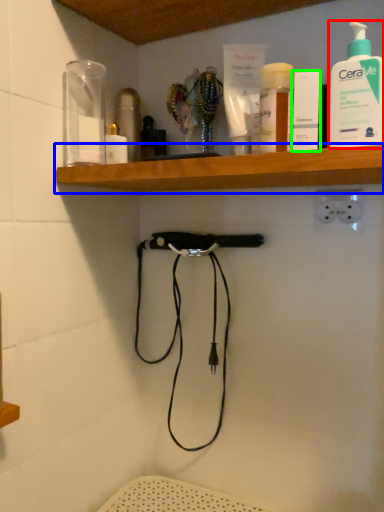
Question: Which object is the farthest from cleaning product (highlighted by a red box)? Choose among these: shelf (highlighted by a blue box) or toiletry (highlighted by a green box).

Choices:
 (A) shelf
 (B) toiletry

Answer: (A)